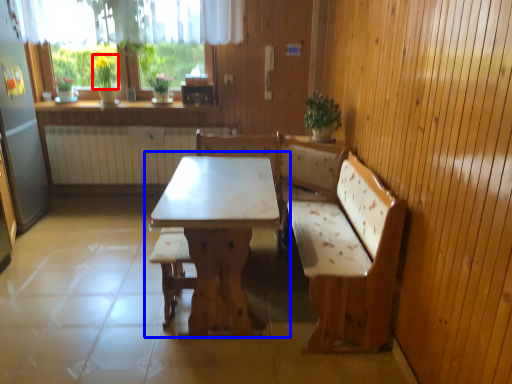
Question: Which object appears farthest to the camera in this image, plant (highlighted by a red box) or table (highlighted by a blue box)?

Choices:
 (A) plant
 (B) table

Answer: (A)